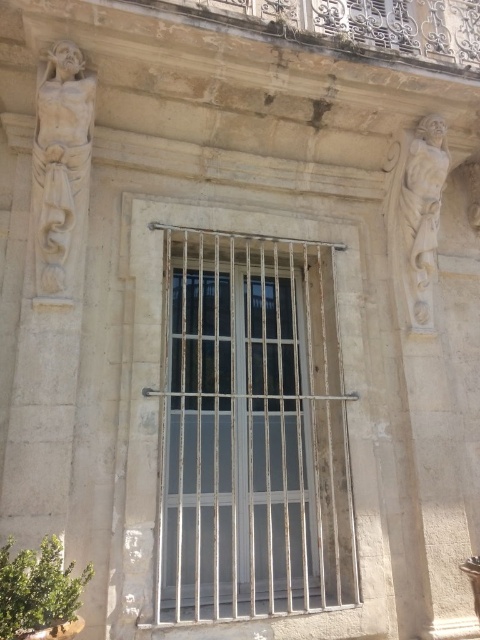
Which is above, metallic bars at center or white marble statue at left?

white marble statue at left is above.

The width and height of the screenshot is (480, 640). What do you see at coordinates (252, 432) in the screenshot?
I see `metallic bars at center` at bounding box center [252, 432].

Does point (167, 268) come closer to viewer compared to point (73, 60)?

No, it is behind (73, 60).

Find the location of `metallic bars at center`. metallic bars at center is located at coordinates (252, 432).

Between metallic bars at center and white stone statue at right, which one has less height?

white stone statue at right

Between point (189, 371) and point (443, 182), which one is positioned behind?

The point (443, 182) is more distant.

This screenshot has height=640, width=480. In order to click on metallic bars at center in this screenshot , I will do `click(252, 432)`.

Does white marble statue at left have a smaller size compared to white stone statue at right?

Correct, white marble statue at left occupies less space than white stone statue at right.

Can you confirm if white marble statue at left is bigger than white stone statue at right?

No, white marble statue at left is not bigger than white stone statue at right.

Looking at this image, who is more distant from viewer, (x=49, y=266) or (x=432, y=257)?

The point (x=432, y=257) is behind.

Identify the location of white marble statue at left. (60, 163).